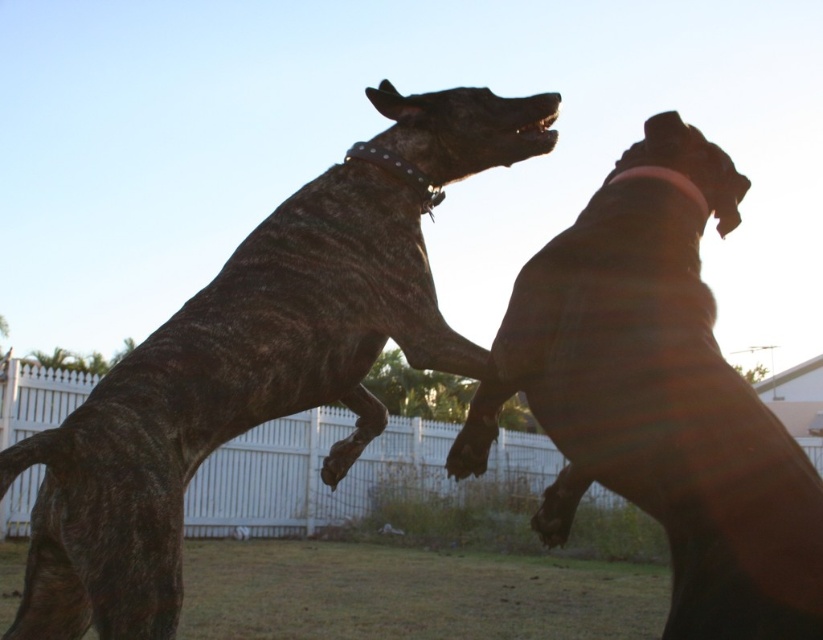
Who is positioned more to the left, speckled fur dog at upper center or white picket fence at center?

white picket fence at center is more to the left.

Does speckled fur dog at upper center appear over white picket fence at center?

Indeed, speckled fur dog at upper center is positioned over white picket fence at center.

Which is in front, point (416, 124) or point (40, 477)?

Point (416, 124) is in front.

Identify the location of speckled fur dog at upper center. Image resolution: width=823 pixels, height=640 pixels. (257, 360).

Is brown matte dog at upper right below white picket fence at center?

No.

Measure the distance between point (x=611, y=362) and camera.

Point (x=611, y=362) and camera are 2.21 meters apart from each other.

What do you see at coordinates (659, 396) in the screenshot? Image resolution: width=823 pixels, height=640 pixels. I see `brown matte dog at upper right` at bounding box center [659, 396].

Find the location of a particular element. The image size is (823, 640). brown matte dog at upper right is located at coordinates (659, 396).

Can you confirm if speckled fur dog at upper center is positioned below brown matte dog at upper right?

No.

Is speckled fur dog at upper center further to the viewer compared to brown matte dog at upper right?

That is True.

Identify the location of speckled fur dog at upper center. This screenshot has height=640, width=823. (257, 360).